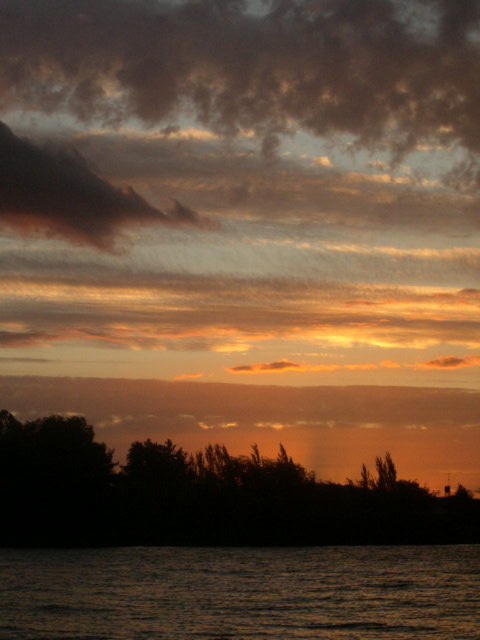
Does dark water at bottom have a lesser height compared to dark green leafy trees at lower center?

Correct, dark water at bottom is not as tall as dark green leafy trees at lower center.

Is point (41, 552) in front of point (399, 509)?

Yes.

The height and width of the screenshot is (640, 480). I want to click on dark water at bottom, so pyautogui.click(x=240, y=593).

What are the coordinates of `dark water at bottom` in the screenshot? It's located at click(240, 593).